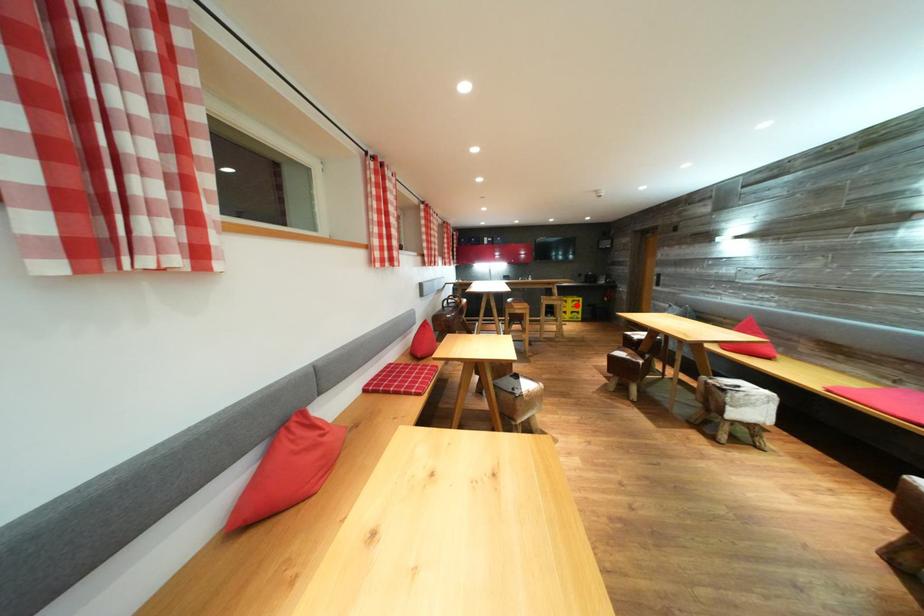
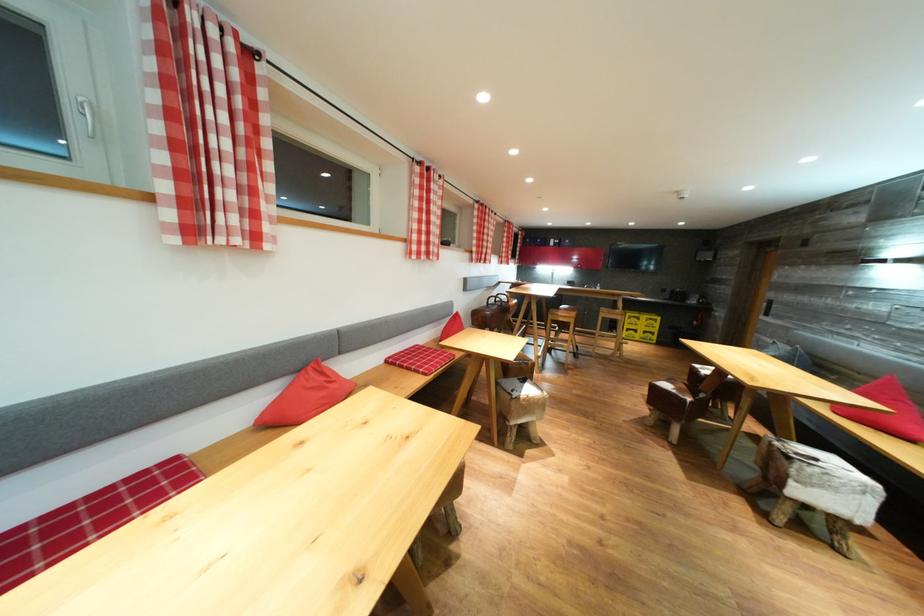
In the second image, find the point that corresponds to the highlighted location in the first image.

(650, 323)